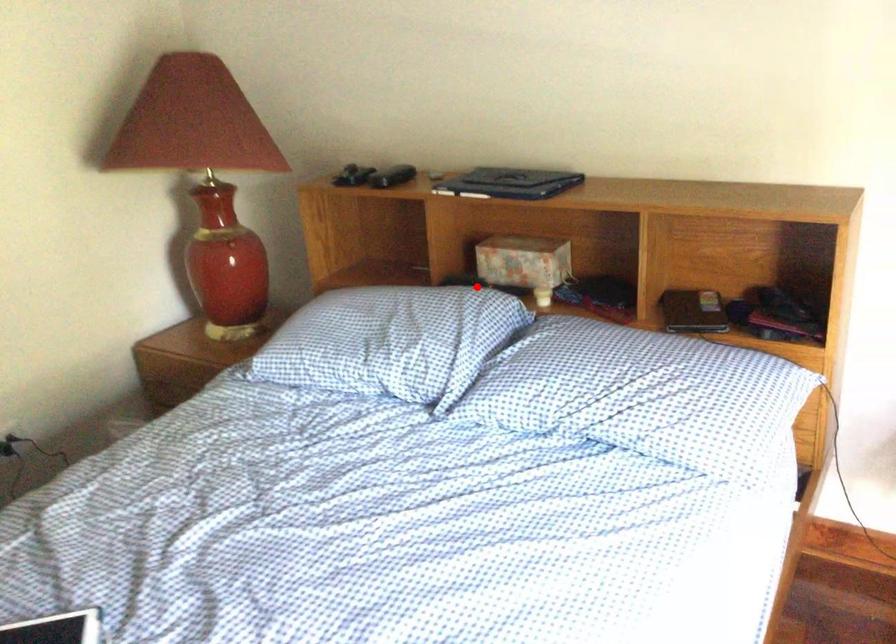
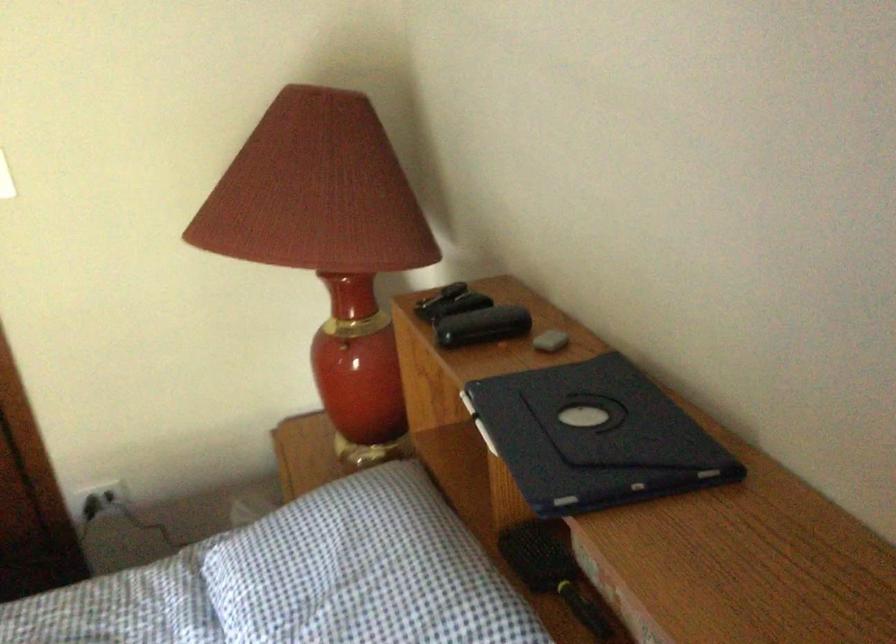
Question: A red point is marked in image1. In image2, is the corresponding 3D point closer to the camera or farther? Reply with the corresponding letter.

Choices:
 (A) The corresponding 3D point is closer.
 (B) The corresponding 3D point is farther.

Answer: (A)